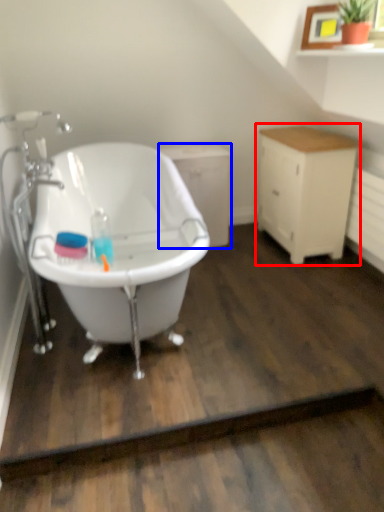
Question: Which point is further to the camera, cabinetry (highlighted by a red box) or cabinetry (highlighted by a blue box)?

Choices:
 (A) cabinetry
 (B) cabinetry

Answer: (B)